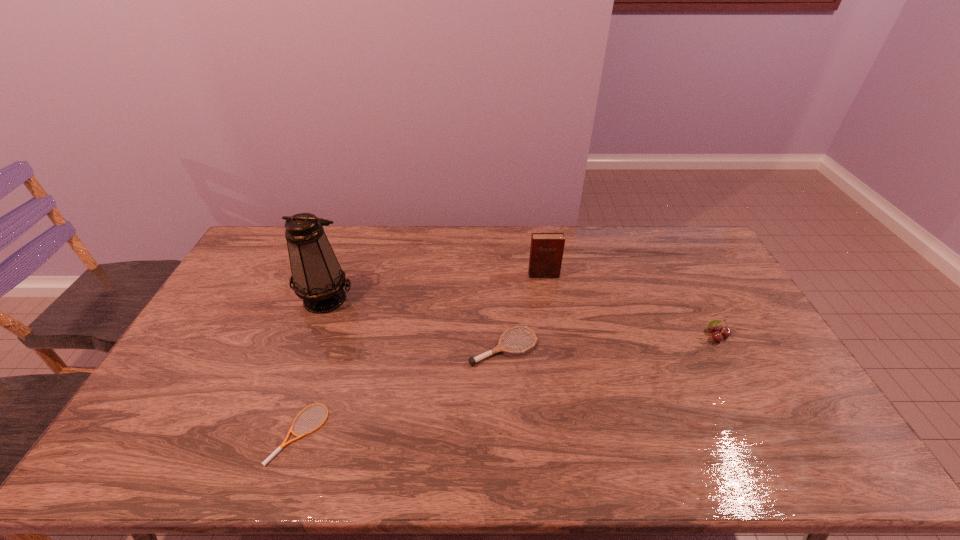
This screenshot has height=540, width=960. Identify the location of free space between the farthest object and the fourth tallest object. (523, 311).

Image resolution: width=960 pixels, height=540 pixels. What are the coordinates of `object that can be found as the fourth closest to the oil lamp` in the screenshot? It's located at (718, 335).

Identify the location of object that stands as the second closest to the nearest object. (500, 347).

You are a GUI agent. You are given a task and a screenshot of the screen. Output one action in this format:
    pyautogui.click(x=<x>, y=<y>)
    Task: Click on the vacant space that satisfies the following two spatial constraints: 1. on the back side of the right tennis racket; 2. on the left side of the nearest object
    This screenshot has width=960, height=540.
    Given the screenshot: What is the action you would take?
    pyautogui.click(x=329, y=348)